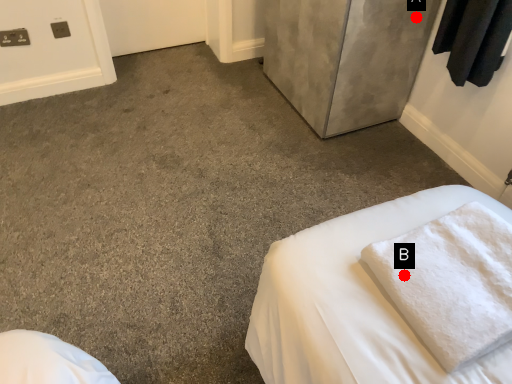
Question: Two points are circled on the image, labeled by A and B beside each circle. Which point appears farthest from the camera in this image?

Choices:
 (A) A is further
 (B) B is further

Answer: (A)